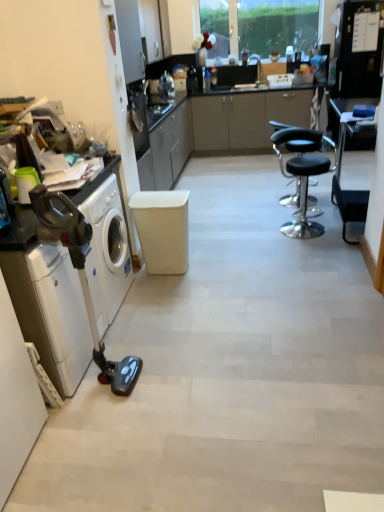
Question: Does white matte stool at center have a larger size compared to metallic gray vacuum cleaner at left?

Choices:
 (A) yes
 (B) no

Answer: (B)

Question: Does white matte stool at center have a lesser width compared to metallic gray vacuum cleaner at left?

Choices:
 (A) no
 (B) yes

Answer: (B)

Question: Would you say white matte stool at center contains metallic gray vacuum cleaner at left?

Choices:
 (A) yes
 (B) no

Answer: (B)

Question: Can you see white matte stool at center touching metallic gray vacuum cleaner at left?

Choices:
 (A) no
 (B) yes

Answer: (A)

Question: Can you confirm if white matte stool at center is wider than metallic gray vacuum cleaner at left?

Choices:
 (A) yes
 (B) no

Answer: (B)

Question: Is metallic gray vacuum cleaner at left at the back of white matte stool at center?

Choices:
 (A) yes
 (B) no

Answer: (B)

Question: Can you confirm if black leather stool at center is smaller than black plastic table at right?

Choices:
 (A) yes
 (B) no

Answer: (A)

Question: Considering the relative sizes of black leather stool at center and black plastic table at right in the image provided, is black leather stool at center wider than black plastic table at right?

Choices:
 (A) yes
 (B) no

Answer: (A)

Question: Is black plastic table at right at the back of black leather stool at center?

Choices:
 (A) no
 (B) yes

Answer: (A)

Question: Considering the relative positions of black leather stool at center and black plastic table at right in the image provided, is black leather stool at center behind black plastic table at right?

Choices:
 (A) yes
 (B) no

Answer: (A)

Question: Is black leather stool at center not inside black plastic table at right?

Choices:
 (A) yes
 (B) no

Answer: (A)

Question: From a real-world perspective, does black leather stool at center stand above black plastic table at right?

Choices:
 (A) yes
 (B) no

Answer: (B)

Question: From the image's perspective, does white glossy washing machine at left, marked as the second washing machine in a front-to-back arrangement, appear higher than white matte stool at center?

Choices:
 (A) no
 (B) yes

Answer: (A)